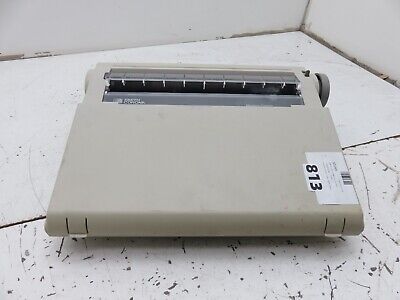
At what (x,y) coordinates should I click in order to perform the action: click on typewriter. Please return your answer as a coordinate pair (x, y). This screenshot has height=300, width=400. Looking at the image, I should click on (244, 168).